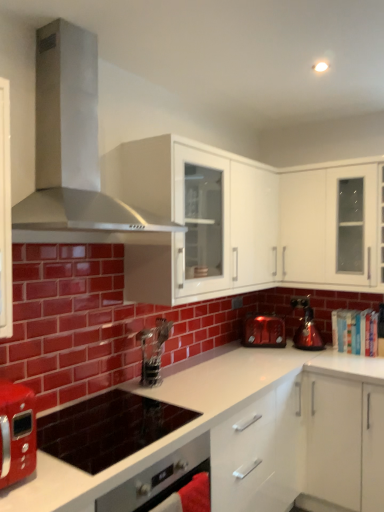
I want to click on blank space situated above white glossy countertop at center (from a real-world perspective), so click(x=180, y=391).